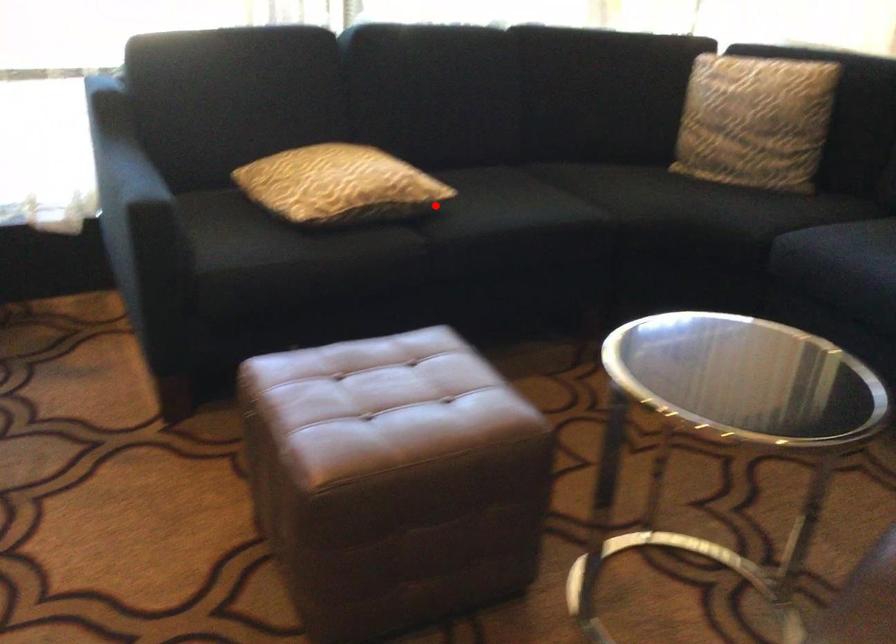
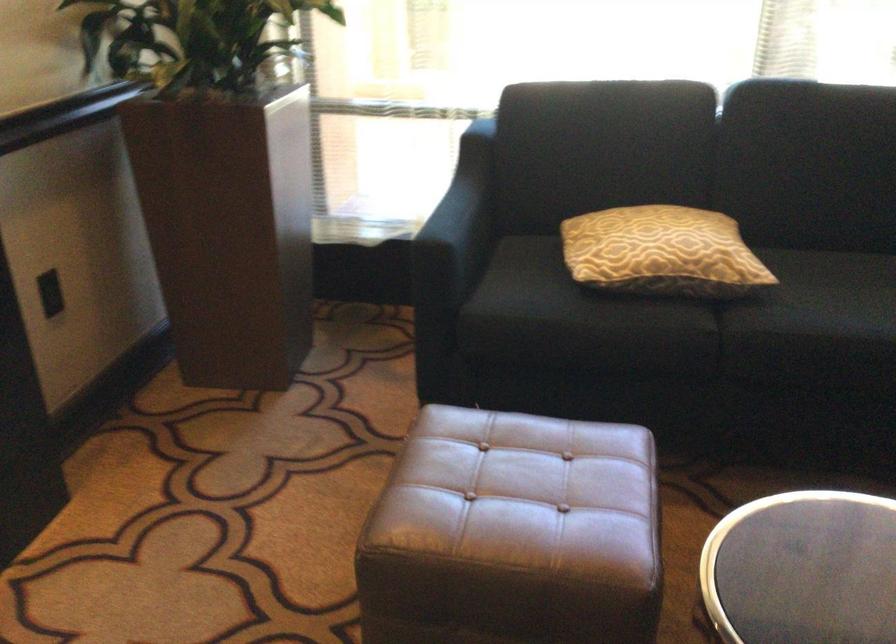
Question: A red point is marked in image1. In image2, is the corresponding 3D point closer to the camera or farther? Reply with the corresponding letter.

Choices:
 (A) The corresponding 3D point is closer.
 (B) The corresponding 3D point is farther.

Answer: (A)